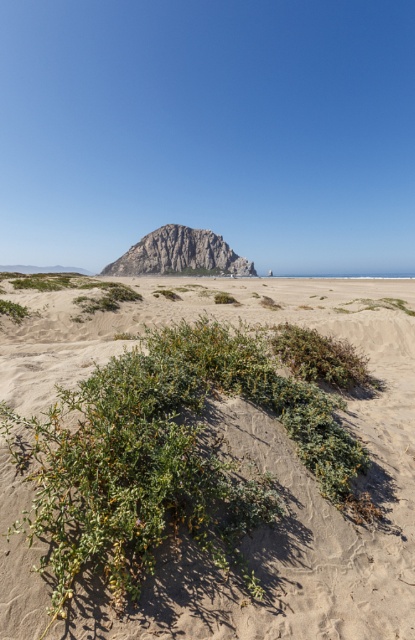
Is point (373, 490) closer to viewer compared to point (151, 232)?

Yes, point (373, 490) is closer to viewer.

At what (x,y) coordinates should I click in order to perform the action: click on green shrubbery at center. Please return your answer as a coordinate pair (x, y). Looking at the image, I should click on (253, 465).

At what (x,y) coordinates should I click in order to perform the action: click on green shrubbery at center. Please return your answer as a coordinate pair (x, y). Image resolution: width=415 pixels, height=640 pixels. Looking at the image, I should click on (253, 465).